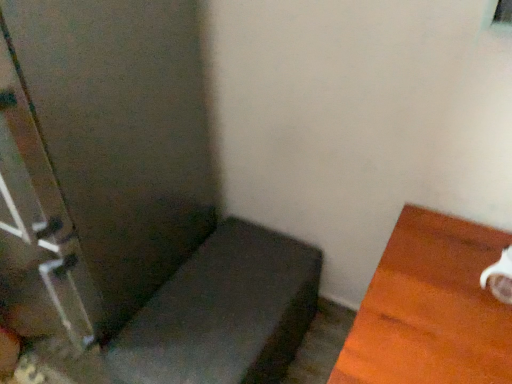
Question: Is clear glass screen door at left at the right side of matte gray cushion at lower left, positioned as the 2th furniture in right-to-left order?

Choices:
 (A) no
 (B) yes

Answer: (A)

Question: Does clear glass screen door at left have a lesser width compared to matte gray cushion at lower left, which is counted as the 1th furniture, starting from the left?

Choices:
 (A) yes
 (B) no

Answer: (B)

Question: Is there a large distance between clear glass screen door at left and matte gray cushion at lower left, positioned as the 2th furniture in right-to-left order?

Choices:
 (A) no
 (B) yes

Answer: (A)

Question: From a real-world perspective, is clear glass screen door at left positioned over matte gray cushion at lower left, positioned as the 2th furniture in right-to-left order, based on gravity?

Choices:
 (A) no
 (B) yes

Answer: (B)

Question: Could you tell me if clear glass screen door at left is facing matte gray cushion at lower left, positioned as the 2th furniture in right-to-left order?

Choices:
 (A) no
 (B) yes

Answer: (A)

Question: In terms of height, does white glossy mug at right, which is the first furniture from right to left, look taller or shorter compared to clear glass screen door at left?

Choices:
 (A) tall
 (B) short

Answer: (B)

Question: Based on their positions, is white glossy mug at right, which is the 2th furniture from left to right, located to the left or right of clear glass screen door at left?

Choices:
 (A) left
 (B) right

Answer: (B)

Question: From a real-world perspective, relative to clear glass screen door at left, is white glossy mug at right, which is the first furniture from right to left, vertically above or below?

Choices:
 (A) below
 (B) above

Answer: (A)

Question: Is white glossy mug at right, which is the first furniture from right to left, spatially inside clear glass screen door at left, or outside of it?

Choices:
 (A) inside
 (B) outside

Answer: (B)

Question: Considering their positions, is white glossy mug at right, which is the first furniture from right to left, located in front of or behind matte gray cushion at lower left, which is counted as the 1th furniture, starting from the left?

Choices:
 (A) front
 (B) behind

Answer: (A)

Question: Visually, is white glossy mug at right, which is the 2th furniture from left to right, positioned to the left or to the right of matte gray cushion at lower left, which is counted as the 1th furniture, starting from the left?

Choices:
 (A) left
 (B) right

Answer: (B)

Question: Considering the positions of white glossy mug at right, which is the first furniture from right to left, and matte gray cushion at lower left, positioned as the 2th furniture in right-to-left order, in the image, is white glossy mug at right, which is the first furniture from right to left, taller or shorter than matte gray cushion at lower left, positioned as the 2th furniture in right-to-left order,?

Choices:
 (A) tall
 (B) short

Answer: (A)

Question: Looking at the image, does white glossy mug at right, which is the 2th furniture from left to right, seem bigger or smaller compared to matte gray cushion at lower left, which is counted as the 1th furniture, starting from the left?

Choices:
 (A) small
 (B) big

Answer: (B)

Question: From the image's perspective, is matte gray cushion at lower left, positioned as the 2th furniture in right-to-left order, above or below clear glass screen door at left?

Choices:
 (A) below
 (B) above

Answer: (A)

Question: From a real-world perspective, relative to clear glass screen door at left, is matte gray cushion at lower left, which is counted as the 1th furniture, starting from the left, vertically above or below?

Choices:
 (A) above
 (B) below

Answer: (B)